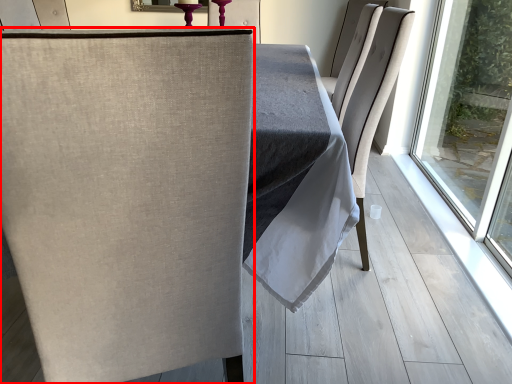
Question: Where is chair (annotated by the red box) located in relation to chair in the image?

Choices:
 (A) right
 (B) left

Answer: (B)